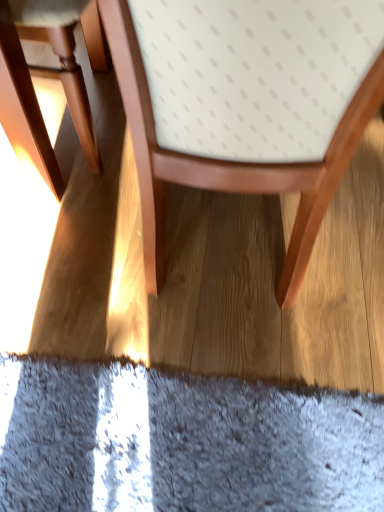
This screenshot has height=512, width=384. Describe the element at coordinates (48, 77) in the screenshot. I see `matte wood chair at left, placed as the second chair when sorted from right to left` at that location.

You are a GUI agent. You are given a task and a screenshot of the screen. Output one action in this format:
    pyautogui.click(x=<x>, y=<y>)
    Task: Click on the matte wood chair at left, which is the 1th chair in left-to-right order
    The image size is (384, 512).
    Given the screenshot: What is the action you would take?
    pyautogui.click(x=48, y=77)

In order to face matte wood chair at left, which is the 1th chair in left-to-right order, should I rotate leftwards or rightwards?

To align with it, rotate left about 20.311°.

At what (x,y) coordinates should I click in order to perform the action: click on wooden chair at center, the second chair in the left-to-right sequence. Please return your answer as a coordinate pair (x, y). This screenshot has height=512, width=384. Looking at the image, I should click on (245, 104).

What do you see at coordinates (245, 104) in the screenshot? The width and height of the screenshot is (384, 512). I see `wooden chair at center, the 1th chair when ordered from right to left` at bounding box center [245, 104].

At what (x,y) coordinates should I click in order to perform the action: click on matte wood chair at left, which is the 1th chair in left-to-right order. Please return your answer as a coordinate pair (x, y). The image size is (384, 512). Looking at the image, I should click on (48, 77).

Between matte wood chair at left, placed as the second chair when sorted from right to left, and wooden chair at center, the second chair in the left-to-right sequence, which one appears on the left side from the viewer's perspective?

From the viewer's perspective, matte wood chair at left, placed as the second chair when sorted from right to left, appears more on the left side.

Considering the positions of objects matte wood chair at left, which is the 1th chair in left-to-right order, and wooden chair at center, the 1th chair when ordered from right to left, in the image provided, who is in front, matte wood chair at left, which is the 1th chair in left-to-right order, or wooden chair at center, the 1th chair when ordered from right to left,?

wooden chair at center, the 1th chair when ordered from right to left, is more forward.

Which is closer, (68, 91) or (198, 118)?

Point (68, 91).

From the image's perspective, is matte wood chair at left, placed as the second chair when sorted from right to left, located beneath wooden chair at center, the 1th chair when ordered from right to left?

No, from the image's perspective, matte wood chair at left, placed as the second chair when sorted from right to left, is not beneath wooden chair at center, the 1th chair when ordered from right to left.

Consider the image. From a real-world perspective, which object stands above the other?

In real-world perspective, wooden chair at center, the second chair in the left-to-right sequence, is above.

Does matte wood chair at left, which is the 1th chair in left-to-right order, have a lesser width compared to wooden chair at center, the second chair in the left-to-right sequence?

Yes.

From their relative heights in the image, would you say matte wood chair at left, placed as the second chair when sorted from right to left, is taller or shorter than wooden chair at center, the 1th chair when ordered from right to left?

Clearly, matte wood chair at left, placed as the second chair when sorted from right to left, is shorter compared to wooden chair at center, the 1th chair when ordered from right to left.

Can you confirm if matte wood chair at left, placed as the second chair when sorted from right to left, is smaller than wooden chair at center, the 1th chair when ordered from right to left?

Yes, matte wood chair at left, placed as the second chair when sorted from right to left, is smaller than wooden chair at center, the 1th chair when ordered from right to left.

Is matte wood chair at left, which is the 1th chair in left-to-right order, surrounding wooden chair at center, the second chair in the left-to-right sequence?

Actually, wooden chair at center, the second chair in the left-to-right sequence, is outside matte wood chair at left, which is the 1th chair in left-to-right order.

Are matte wood chair at left, placed as the second chair when sorted from right to left, and wooden chair at center, the 1th chair when ordered from right to left, beside each other?

No, matte wood chair at left, placed as the second chair when sorted from right to left, is not beside wooden chair at center, the 1th chair when ordered from right to left.

Could you tell me if matte wood chair at left, placed as the second chair when sorted from right to left, is facing wooden chair at center, the 1th chair when ordered from right to left?

No, matte wood chair at left, placed as the second chair when sorted from right to left, is not turned towards wooden chair at center, the 1th chair when ordered from right to left.

What's the angular difference between matte wood chair at left, placed as the second chair when sorted from right to left, and wooden chair at center, the second chair in the left-to-right sequence,'s facing directions?

The facing directions of matte wood chair at left, placed as the second chair when sorted from right to left, and wooden chair at center, the second chair in the left-to-right sequence, are 91.2 degrees apart.

I want to click on chair above the matte wood chair at left, which is the 1th chair in left-to-right order (from a real-world perspective), so (245, 104).

Considering the positions of objects wooden chair at center, the second chair in the left-to-right sequence, and matte wood chair at left, placed as the second chair when sorted from right to left, in the image provided, who is more to the left, wooden chair at center, the second chair in the left-to-right sequence, or matte wood chair at left, placed as the second chair when sorted from right to left,?

Positioned to the left is matte wood chair at left, placed as the second chair when sorted from right to left.

Relative to matte wood chair at left, which is the 1th chair in left-to-right order, is wooden chair at center, the 1th chair when ordered from right to left, in front or behind?

wooden chair at center, the 1th chair when ordered from right to left, is in front of matte wood chair at left, which is the 1th chair in left-to-right order.

Is point (232, 168) less distant than point (53, 192)?

Yes, it is.

From the image's perspective, which object appears higher, wooden chair at center, the 1th chair when ordered from right to left, or matte wood chair at left, which is the 1th chair in left-to-right order?

matte wood chair at left, which is the 1th chair in left-to-right order.

From a real-world perspective, between wooden chair at center, the 1th chair when ordered from right to left, and matte wood chair at left, which is the 1th chair in left-to-right order, who is vertically higher?

From a 3D spatial view, wooden chair at center, the 1th chair when ordered from right to left, is above.

Considering the relative sizes of wooden chair at center, the 1th chair when ordered from right to left, and matte wood chair at left, placed as the second chair when sorted from right to left, in the image provided, is wooden chair at center, the 1th chair when ordered from right to left, wider than matte wood chair at left, placed as the second chair when sorted from right to left,?

Indeed, wooden chair at center, the 1th chair when ordered from right to left, has a greater width compared to matte wood chair at left, placed as the second chair when sorted from right to left.

Is wooden chair at center, the 1th chair when ordered from right to left, taller than matte wood chair at left, which is the 1th chair in left-to-right order?

Correct, wooden chair at center, the 1th chair when ordered from right to left, is much taller as matte wood chair at left, which is the 1th chair in left-to-right order.

Based on their sizes in the image, would you say wooden chair at center, the 1th chair when ordered from right to left, is bigger or smaller than matte wood chair at left, placed as the second chair when sorted from right to left?

Clearly, wooden chair at center, the 1th chair when ordered from right to left, is larger in size than matte wood chair at left, placed as the second chair when sorted from right to left.

Is wooden chair at center, the 1th chair when ordered from right to left, situated inside matte wood chair at left, which is the 1th chair in left-to-right order, or outside?

wooden chair at center, the 1th chair when ordered from right to left, lies outside matte wood chair at left, which is the 1th chair in left-to-right order.

Are wooden chair at center, the 1th chair when ordered from right to left, and matte wood chair at left, placed as the second chair when sorted from right to left, beside each other?

wooden chair at center, the 1th chair when ordered from right to left, and matte wood chair at left, placed as the second chair when sorted from right to left, are not in contact.

Is wooden chair at center, the 1th chair when ordered from right to left, looking in the opposite direction of matte wood chair at left, placed as the second chair when sorted from right to left?

That's not correct — wooden chair at center, the 1th chair when ordered from right to left, is not looking away from matte wood chair at left, placed as the second chair when sorted from right to left.

How different are the orientations of wooden chair at center, the second chair in the left-to-right sequence, and matte wood chair at left, placed as the second chair when sorted from right to left, in degrees?

They differ by 91.2 degrees in their facing directions.

How far apart are wooden chair at center, the 1th chair when ordered from right to left, and matte wood chair at left, placed as the second chair when sorted from right to left?

They are 44.44 centimeters apart.

The image size is (384, 512). Identify the location of chair above the wooden chair at center, the second chair in the left-to-right sequence (from the image's perspective). (48, 77).

Where is `chair in front of the matte wood chair at left, which is the 1th chair in left-to-right order`? This screenshot has width=384, height=512. chair in front of the matte wood chair at left, which is the 1th chair in left-to-right order is located at coordinates (245, 104).

The width and height of the screenshot is (384, 512). I want to click on chair to the left of wooden chair at center, the second chair in the left-to-right sequence, so [48, 77].